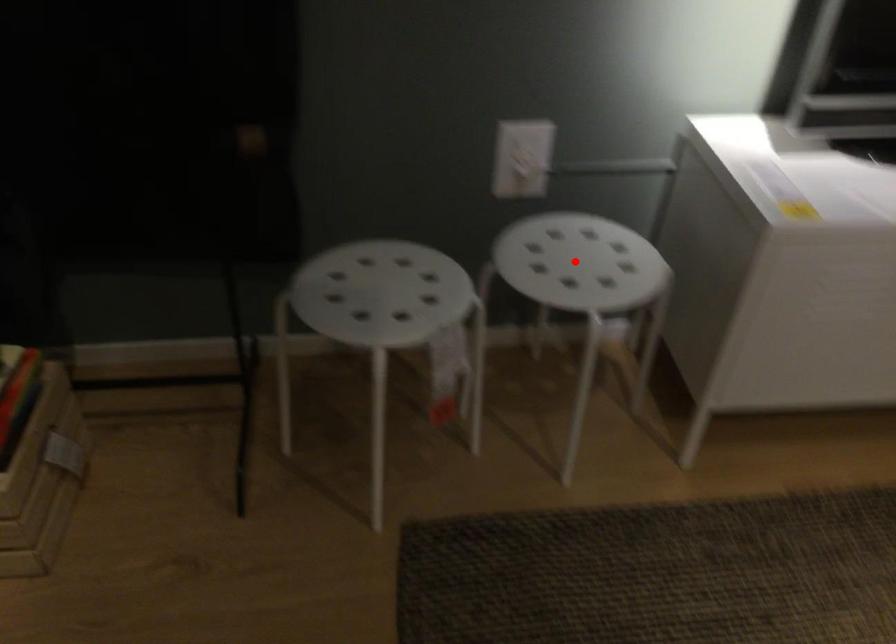
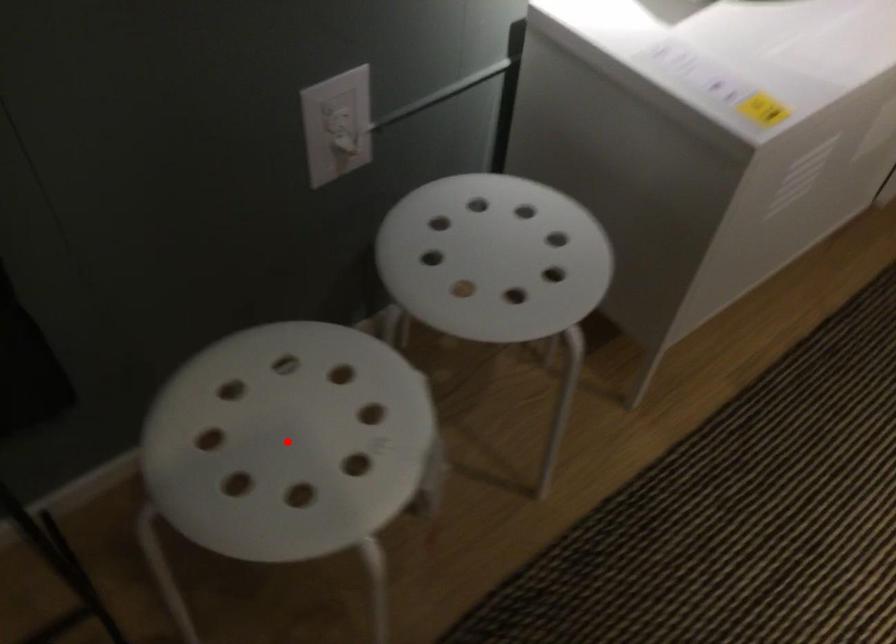
I am providing you with two images of the same scene from different viewpoints. A red point is marked on the first image and another point is marked on the second image. Are the points marked in image1 and image2 representing the same 3D position?

No